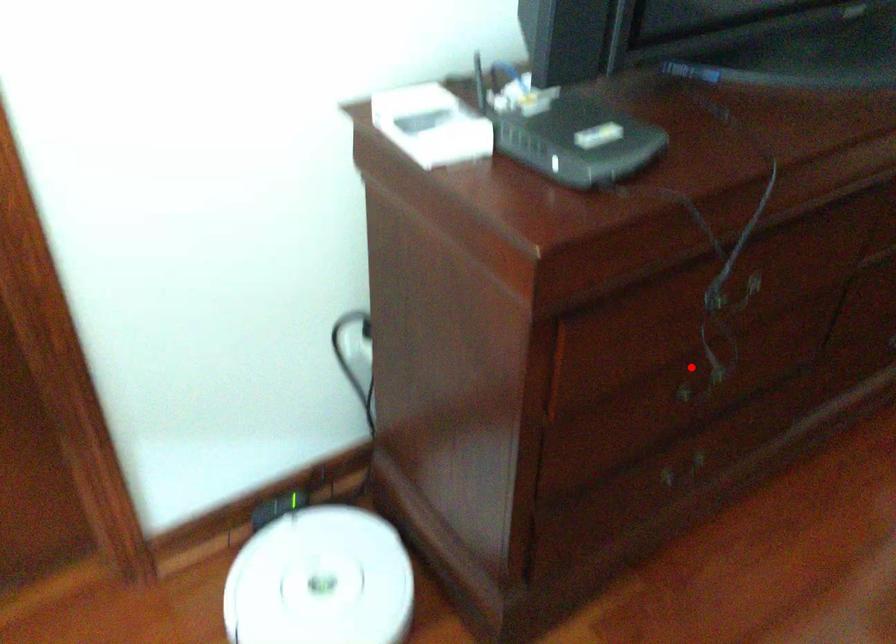
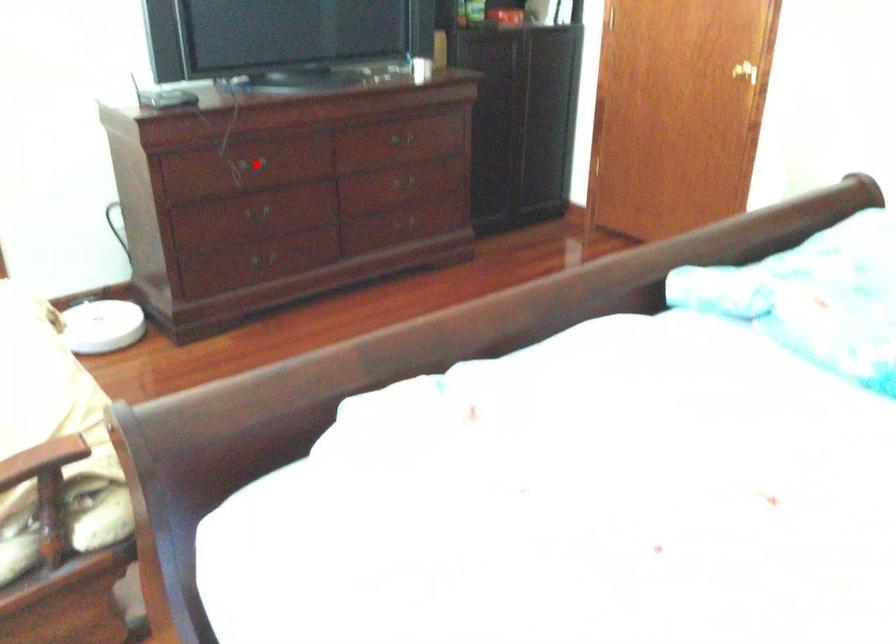
I am providing you with two images of the same scene from different viewpoints. A red point is marked on the first image and another point is marked on the second image. Is the red point in image1 aligned with the point shown in image2?

No